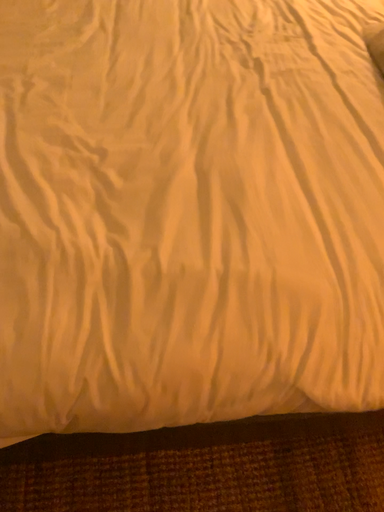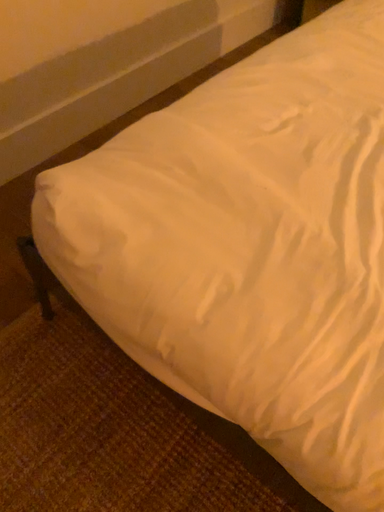
Question: How did the camera likely rotate when shooting the video?

Choices:
 (A) rotated upward
 (B) rotated downward

Answer: (A)